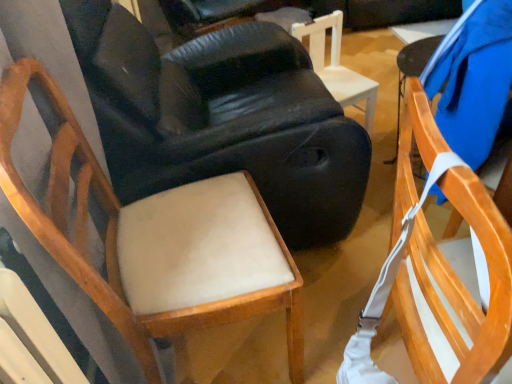
Question: Considering the relative sizes of wooden chair with white straps at right, the first chair positioned from the right, and light brown wood chair at left, which appears as the 4th chair when viewed from the right, in the image provided, is wooden chair with white straps at right, the first chair positioned from the right, bigger than light brown wood chair at left, which appears as the 4th chair when viewed from the right,?

Choices:
 (A) no
 (B) yes

Answer: (B)

Question: From a real-world perspective, is wooden chair with white straps at right, the fourth chair viewed from the left, beneath light brown wood chair at left, which appears as the 4th chair when viewed from the right?

Choices:
 (A) no
 (B) yes

Answer: (B)

Question: Can you confirm if wooden chair with white straps at right, the first chair positioned from the right, is thinner than light brown wood chair at left, which ranks as the first chair in left-to-right order?

Choices:
 (A) yes
 (B) no

Answer: (B)

Question: Considering the relative positions of wooden chair with white straps at right, the fourth chair viewed from the left, and light brown wood chair at left, which appears as the 4th chair when viewed from the right, in the image provided, is wooden chair with white straps at right, the fourth chair viewed from the left, to the left of light brown wood chair at left, which appears as the 4th chair when viewed from the right, from the viewer's perspective?

Choices:
 (A) yes
 (B) no

Answer: (B)

Question: Are wooden chair with white straps at right, the fourth chair viewed from the left, and light brown wood chair at left, which appears as the 4th chair when viewed from the right, beside each other?

Choices:
 (A) no
 (B) yes

Answer: (A)

Question: Considering the positions of white wood chair at center, marked as the second chair in a right-to-left arrangement, and light brown wood chair at left, which ranks as the first chair in left-to-right order, in the image, is white wood chair at center, marked as the second chair in a right-to-left arrangement, taller or shorter than light brown wood chair at left, which ranks as the first chair in left-to-right order,?

Choices:
 (A) short
 (B) tall

Answer: (A)

Question: From a real-world perspective, relative to light brown wood chair at left, which appears as the 4th chair when viewed from the right, is white wood chair at center, which is counted as the 3th chair, starting from the left, vertically above or below?

Choices:
 (A) above
 (B) below

Answer: (B)

Question: Is white wood chair at center, which is counted as the 3th chair, starting from the left, wider or thinner than light brown wood chair at left, which appears as the 4th chair when viewed from the right?

Choices:
 (A) wide
 (B) thin

Answer: (B)

Question: Would you say white wood chair at center, which is counted as the 3th chair, starting from the left, is to the left or to the right of light brown wood chair at left, which appears as the 4th chair when viewed from the right, in the picture?

Choices:
 (A) left
 (B) right

Answer: (B)

Question: In terms of width, does wooden chair with white straps at right, the first chair positioned from the right, look wider or thinner when compared to white wood chair at center, marked as the second chair in a right-to-left arrangement?

Choices:
 (A) thin
 (B) wide

Answer: (B)

Question: Based on their positions, is wooden chair with white straps at right, the first chair positioned from the right, located to the left or right of white wood chair at center, which is counted as the 3th chair, starting from the left?

Choices:
 (A) right
 (B) left

Answer: (A)

Question: From the image's perspective, is wooden chair with white straps at right, the fourth chair viewed from the left, above or below white wood chair at center, which is counted as the 3th chair, starting from the left?

Choices:
 (A) above
 (B) below

Answer: (B)

Question: Is wooden chair with white straps at right, the fourth chair viewed from the left, situated inside white wood chair at center, which is counted as the 3th chair, starting from the left, or outside?

Choices:
 (A) inside
 (B) outside

Answer: (B)

Question: Considering the relative positions of wooden chair with white straps at right, the fourth chair viewed from the left, and light beige fabric chair at center, the third chair when ordered from right to left, in the image provided, is wooden chair with white straps at right, the fourth chair viewed from the left, to the left or to the right of light beige fabric chair at center, the third chair when ordered from right to left,?

Choices:
 (A) right
 (B) left

Answer: (A)

Question: In terms of size, does wooden chair with white straps at right, the first chair positioned from the right, appear bigger or smaller than light beige fabric chair at center, the third chair when ordered from right to left?

Choices:
 (A) big
 (B) small

Answer: (B)